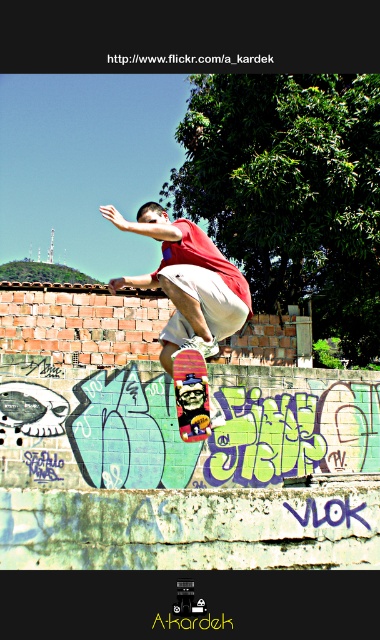
Question: Which point is farther to the camera?

Choices:
 (A) (201, 401)
 (B) (123, 284)

Answer: (B)

Question: Is matte red skateboard at center behind multicolored wooden skateboard at center?

Choices:
 (A) no
 (B) yes

Answer: (B)

Question: Is matte red skateboard at center to the left of multicolored wooden skateboard at center from the viewer's perspective?

Choices:
 (A) no
 (B) yes

Answer: (B)

Question: Can you confirm if matte red skateboard at center is positioned below multicolored wooden skateboard at center?

Choices:
 (A) no
 (B) yes

Answer: (A)